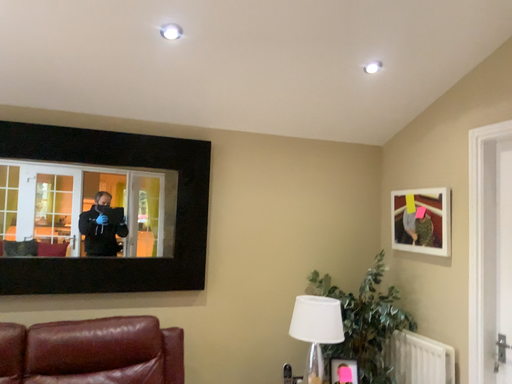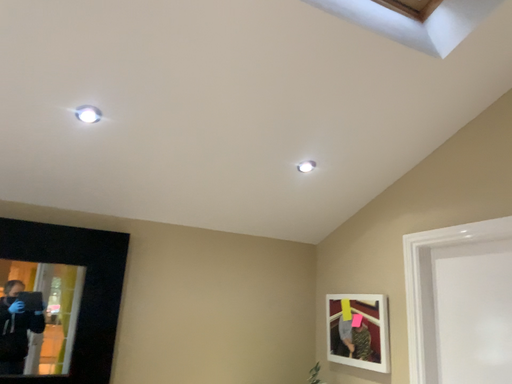
Question: Which way did the camera rotate in the video?

Choices:
 (A) rotated upward
 (B) rotated downward

Answer: (A)